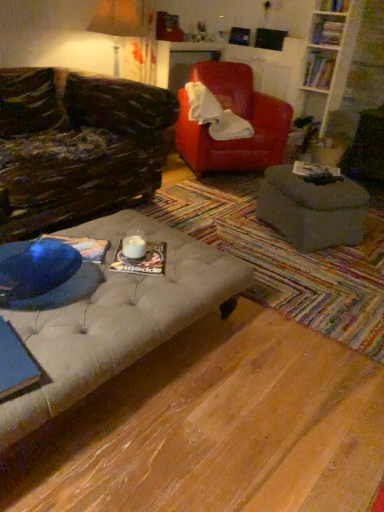
Question: Considering the relative sizes of transparent glass table at lower left and tufted fabric ottoman at center in the image provided, is transparent glass table at lower left smaller than tufted fabric ottoman at center?

Choices:
 (A) no
 (B) yes

Answer: (B)

Question: Can you confirm if transparent glass table at lower left is wider than tufted fabric ottoman at center?

Choices:
 (A) yes
 (B) no

Answer: (B)

Question: From the image's perspective, is transparent glass table at lower left above tufted fabric ottoman at center?

Choices:
 (A) no
 (B) yes

Answer: (A)

Question: Is transparent glass table at lower left with tufted fabric ottoman at center?

Choices:
 (A) no
 (B) yes

Answer: (A)

Question: From a real-world perspective, is transparent glass table at lower left located higher than tufted fabric ottoman at center?

Choices:
 (A) yes
 (B) no

Answer: (A)

Question: Is transparent glass table at lower left not inside tufted fabric ottoman at center?

Choices:
 (A) no
 (B) yes

Answer: (B)

Question: From the image's perspective, would you say hardcover book at center, the fourth book when ordered from back to front, is shown under transparent glass table at lower left?

Choices:
 (A) yes
 (B) no

Answer: (B)

Question: Is hardcover book at center, acting as the 4th book starting from the right, to the right of transparent glass table at lower left from the viewer's perspective?

Choices:
 (A) yes
 (B) no

Answer: (A)

Question: Is hardcover book at center, the 3th book ordered from the bottom, not near transparent glass table at lower left?

Choices:
 (A) no
 (B) yes

Answer: (B)

Question: Does hardcover book at center, positioned as the 4th book in top-to-bottom order, turn towards transparent glass table at lower left?

Choices:
 (A) yes
 (B) no

Answer: (A)

Question: Is hardcover book at center, positioned as the 4th book in top-to-bottom order, outside transparent glass table at lower left?

Choices:
 (A) yes
 (B) no

Answer: (A)

Question: Can you confirm if hardcover book at center, the 3th book ordered from the bottom, is taller than transparent glass table at lower left?

Choices:
 (A) no
 (B) yes

Answer: (A)

Question: Considering the relative positions of hardcover book at center, the 3th book ordered from the bottom, and matte paper book at center, which is the 5th book from right to left, in the image provided, is hardcover book at center, the 3th book ordered from the bottom, to the left of matte paper book at center, which is the 5th book from right to left, from the viewer's perspective?

Choices:
 (A) no
 (B) yes

Answer: (A)